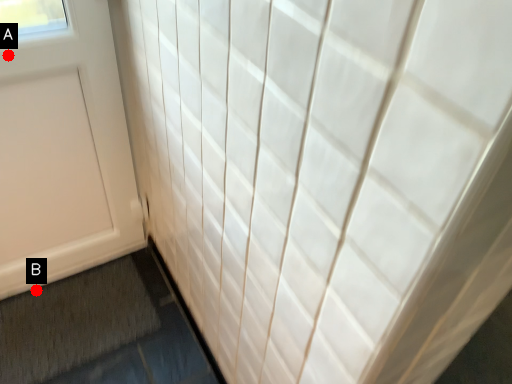
Question: Two points are circled on the image, labeled by A and B beside each circle. Which of the following is the farthest from the observer?

Choices:
 (A) A is further
 (B) B is further

Answer: (B)